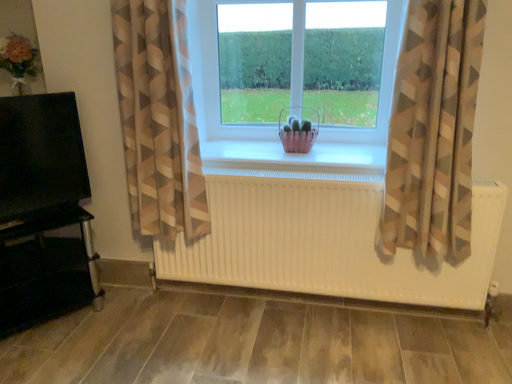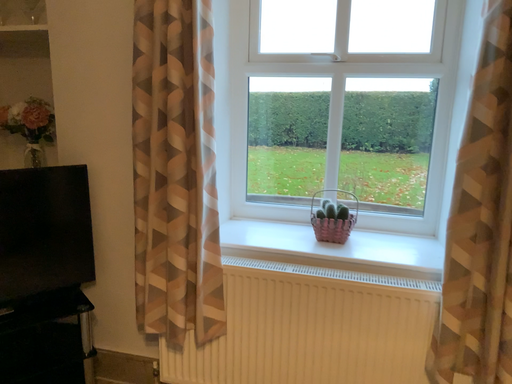
Question: How did the camera likely rotate when shooting the video?

Choices:
 (A) rotated downward
 (B) rotated upward

Answer: (B)